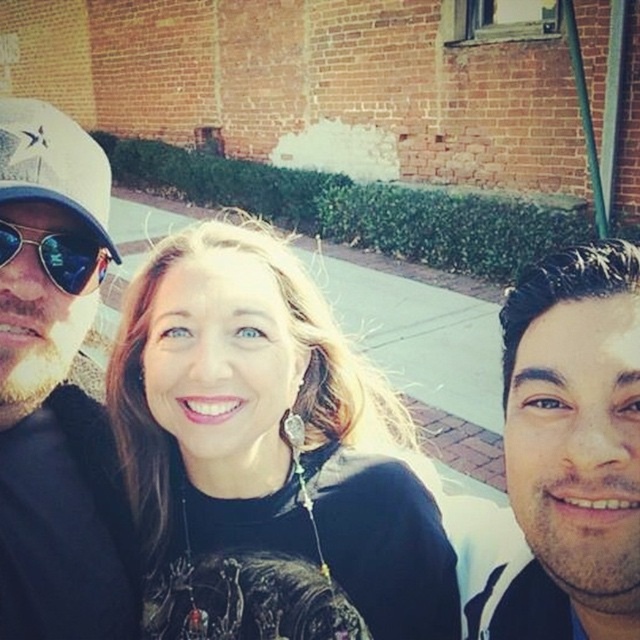
Question: Which point is closer to the camera?

Choices:
 (A) [x=28, y=161]
 (B) [x=80, y=282]

Answer: (A)

Question: Is matte black shirt at center to the right of white matte face at right from the viewer's perspective?

Choices:
 (A) yes
 (B) no

Answer: (B)

Question: Does white matte face at right come in front of matte black sunglasses at left?

Choices:
 (A) no
 (B) yes

Answer: (B)

Question: Considering the real-world distances, which object is closest to the white matte face at right?

Choices:
 (A) white matte baseball cap at left
 (B) matte black sunglasses at left
 (C) matte black cap at left
 (D) matte black shirt at center

Answer: (D)

Question: Among these points, which one is farthest from the camera?

Choices:
 (A) (51, 259)
 (B) (12, 300)
 (C) (536, 380)

Answer: (A)

Question: Is matte black shirt at center bigger than white matte baseball cap at left?

Choices:
 (A) yes
 (B) no

Answer: (A)